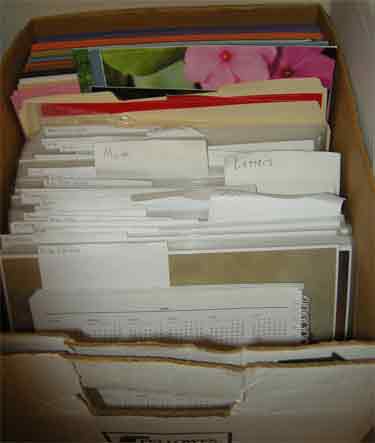
Where is `pink file folder`? The image size is (375, 443). pink file folder is located at coordinates (44, 91).